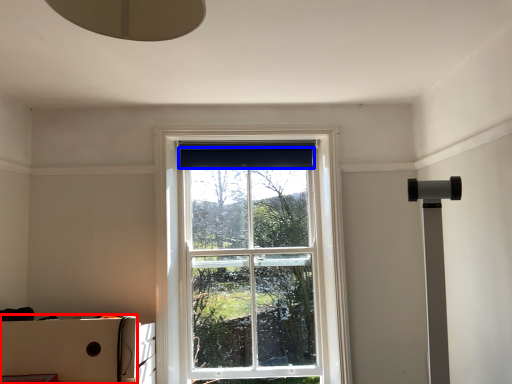
Question: Which point is closer to the camera, cardboard box (highlighted by a red box) or curtain (highlighted by a blue box)?

Choices:
 (A) cardboard box
 (B) curtain

Answer: (A)